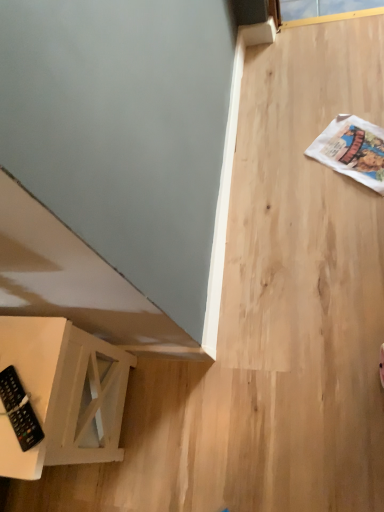
Question: Is black plastic remote at lower left oriented towards white wood side table at lower left?

Choices:
 (A) yes
 (B) no

Answer: (B)

Question: Is black plastic remote at lower left outside of white wood side table at lower left?

Choices:
 (A) yes
 (B) no

Answer: (A)

Question: Can you confirm if black plastic remote at lower left is positioned to the right of white wood side table at lower left?

Choices:
 (A) no
 (B) yes

Answer: (B)

Question: Is black plastic remote at lower left closer to the viewer compared to white wood side table at lower left?

Choices:
 (A) yes
 (B) no

Answer: (B)

Question: Considering the relative sizes of black plastic remote at lower left and white wood side table at lower left in the image provided, is black plastic remote at lower left thinner than white wood side table at lower left?

Choices:
 (A) no
 (B) yes

Answer: (B)

Question: From a real-world perspective, is black plastic remote at lower left over white wood side table at lower left?

Choices:
 (A) yes
 (B) no

Answer: (A)

Question: Is white wood side table at lower left smaller than black plastic remote at lower left?

Choices:
 (A) yes
 (B) no

Answer: (B)

Question: Considering the relative sizes of white wood side table at lower left and black plastic remote at lower left in the image provided, is white wood side table at lower left taller than black plastic remote at lower left?

Choices:
 (A) yes
 (B) no

Answer: (A)

Question: From the image's perspective, is white wood side table at lower left over black plastic remote at lower left?

Choices:
 (A) no
 (B) yes

Answer: (A)

Question: From the image's perspective, is white wood side table at lower left beneath black plastic remote at lower left?

Choices:
 (A) no
 (B) yes

Answer: (B)

Question: Does white wood side table at lower left come behind black plastic remote at lower left?

Choices:
 (A) no
 (B) yes

Answer: (A)

Question: Is the depth of white wood side table at lower left less than that of black plastic remote at lower left?

Choices:
 (A) yes
 (B) no

Answer: (A)

Question: Considering the positions of black plastic remote at lower left and white wood side table at lower left in the image, is black plastic remote at lower left wider or thinner than white wood side table at lower left?

Choices:
 (A) thin
 (B) wide

Answer: (A)